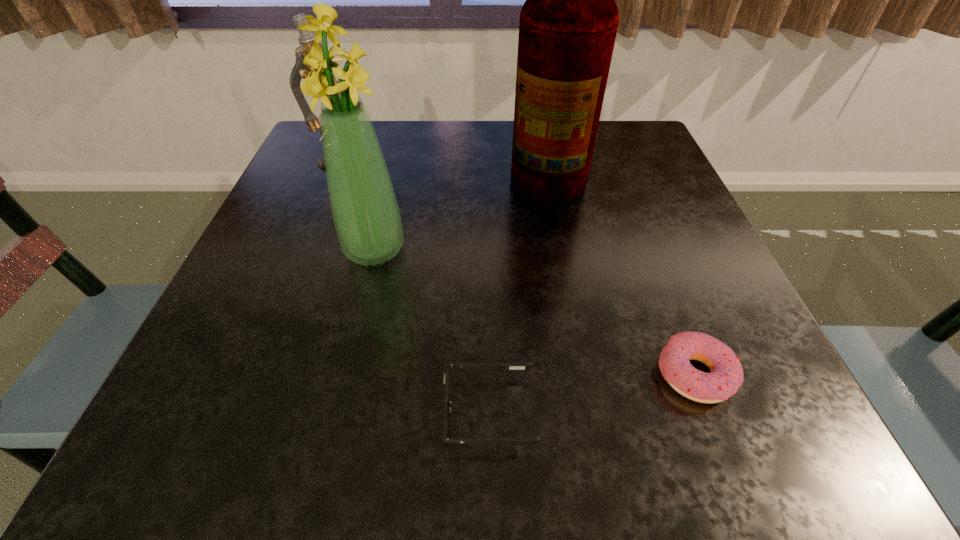
Where is `free space located 0.220m on the front-facing side of the third nearest object`? The height and width of the screenshot is (540, 960). free space located 0.220m on the front-facing side of the third nearest object is located at coordinates (342, 386).

You are a GUI agent. You are given a task and a screenshot of the screen. Output one action in this format:
    pyautogui.click(x=<x>, y=<y>)
    Task: Click on the free point located 0.400m on the front of the third tallest object
    The width and height of the screenshot is (960, 540).
    Given the screenshot: What is the action you would take?
    pyautogui.click(x=288, y=308)

Where is `vacant space located on the left of the doughnut`? The width and height of the screenshot is (960, 540). vacant space located on the left of the doughnut is located at coordinates (436, 375).

Where is `vacant space located on the temples of the sunglasses`? This screenshot has width=960, height=540. vacant space located on the temples of the sunglasses is located at coordinates (306, 411).

Locate an element on the screen. vacant space located on the temples of the sunglasses is located at coordinates (345, 411).

I want to click on free point located 0.130m on the temples of the sunglasses, so click(x=345, y=411).

This screenshot has width=960, height=540. I want to click on fire extinguisher that is at the far edge, so click(568, 24).

Locate an element on the screen. The image size is (960, 540). microscope that is positioned at the far edge is located at coordinates (x=306, y=39).

I want to click on doughnut that is at the near edge, so click(x=726, y=376).

Find the location of a particular element. The image size is (960, 540). sunglasses that is at the near edge is located at coordinates (514, 441).